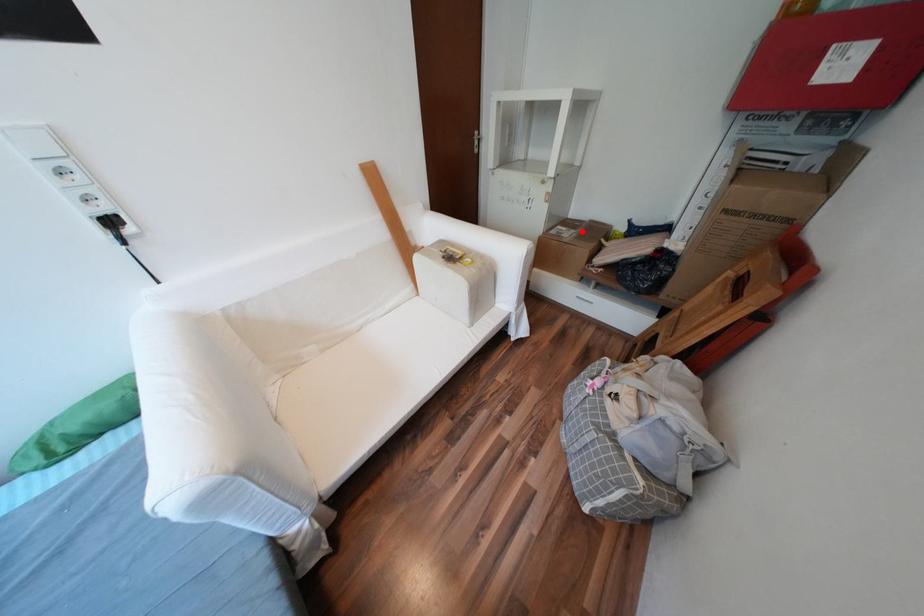
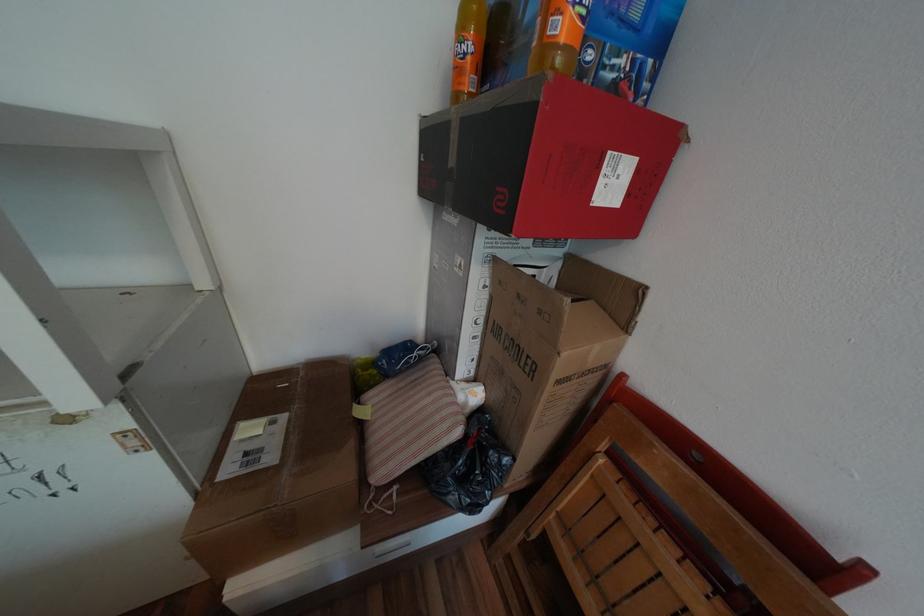
Locate, in the second image, the point that corresponds to the highlighted location in the first image.

(293, 416)